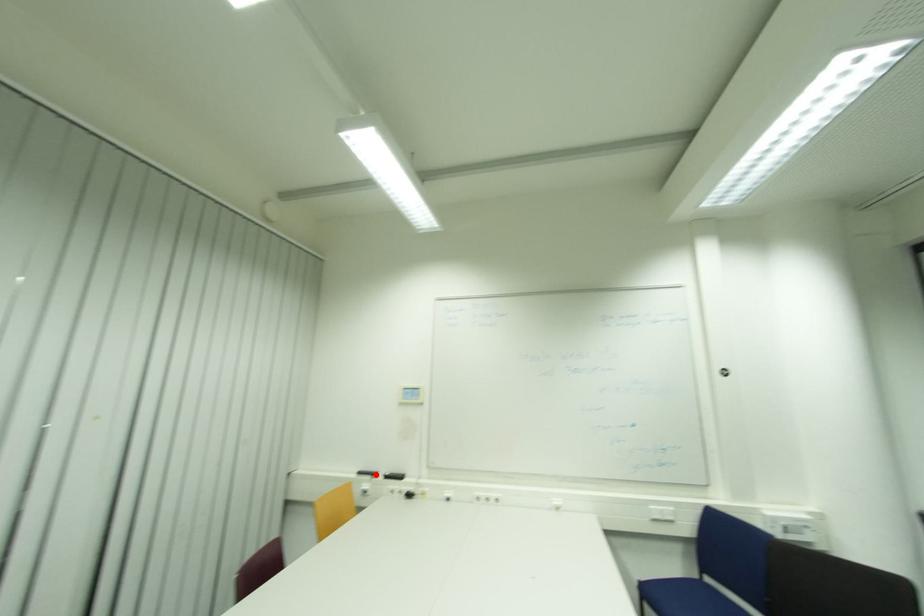
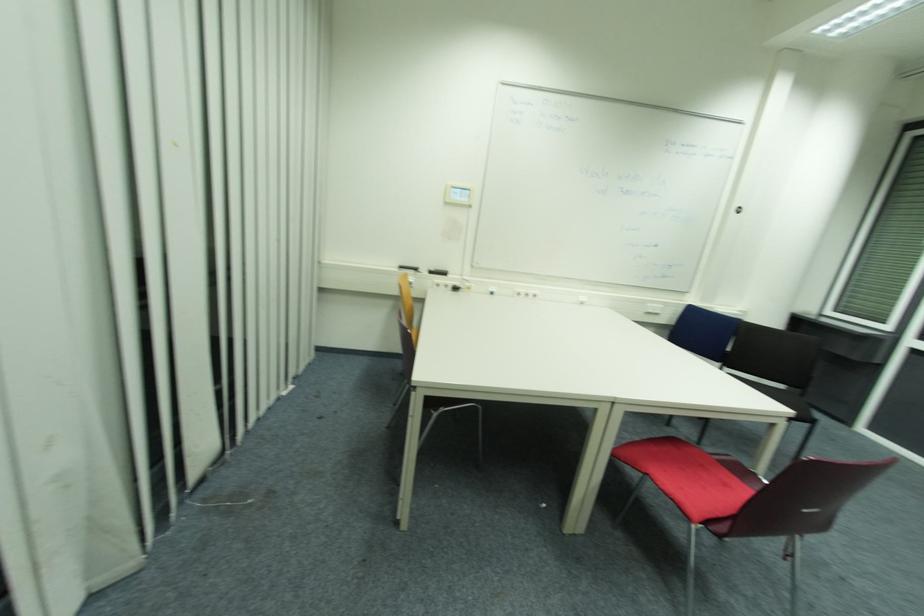
In the second image, find the point that corresponds to the highlighted location in the first image.

(419, 270)